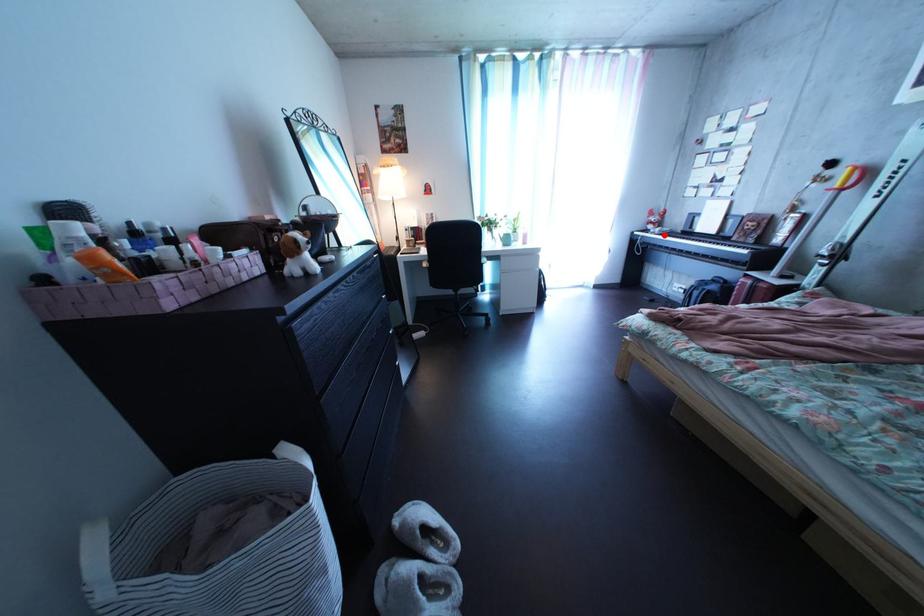
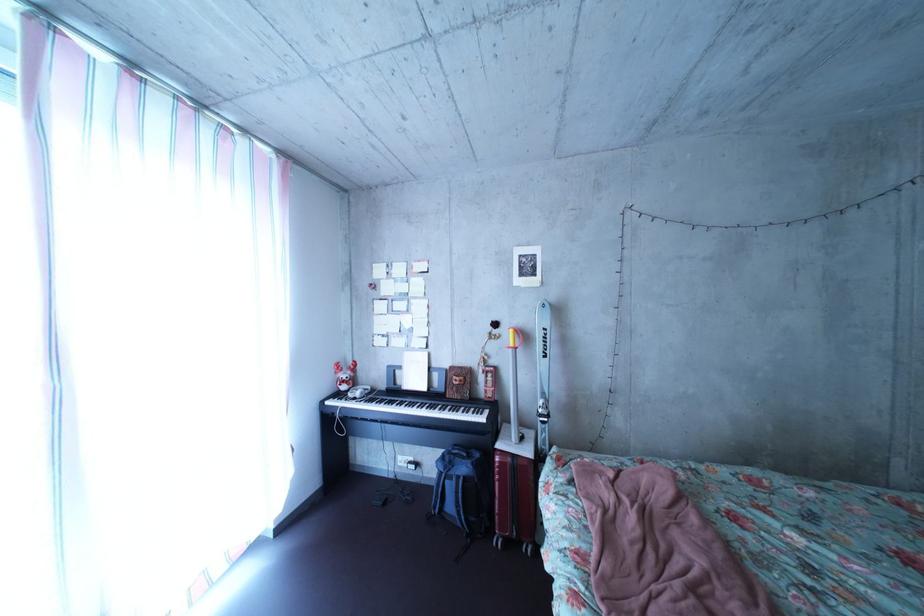
Question: I am providing you with two images of the same scene from different viewpoints. In image1, a red point is highlighted. Considering the same 3D point in image2, which of the following is correct?

Choices:
 (A) It is closer
 (B) It is farther

Answer: (B)